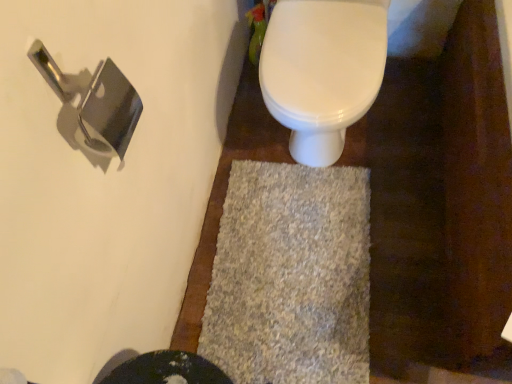
This screenshot has height=384, width=512. What are the coordinates of `vacant region above gray shaggy bath mat at center (from a real-world perspective)` in the screenshot? It's located at (289, 260).